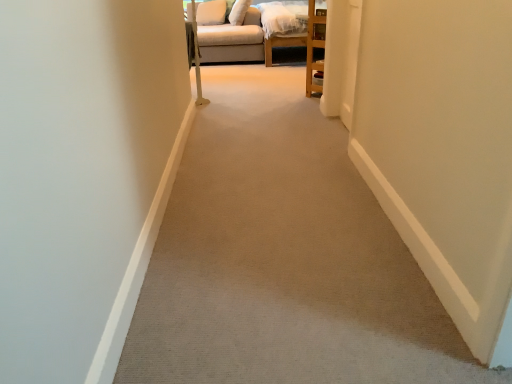
Question: Can you confirm if beige carpet at center is bigger than beige fabric pillow at upper center, which is the 1th pillow in right-to-left order?

Choices:
 (A) no
 (B) yes

Answer: (B)

Question: Is beige carpet at center positioned far away from beige fabric pillow at upper center, which is the 1th pillow in right-to-left order?

Choices:
 (A) yes
 (B) no

Answer: (A)

Question: From a real-world perspective, is beige carpet at center under beige fabric pillow at upper center, marked as the 2th pillow in a left-to-right arrangement?

Choices:
 (A) yes
 (B) no

Answer: (A)

Question: From a real-world perspective, is beige carpet at center on beige fabric pillow at upper center, marked as the 2th pillow in a left-to-right arrangement?

Choices:
 (A) no
 (B) yes

Answer: (A)

Question: Are beige carpet at center and beige fabric pillow at upper center, marked as the 2th pillow in a left-to-right arrangement, making contact?

Choices:
 (A) yes
 (B) no

Answer: (B)

Question: From the image's perspective, is white fabric pillow at upper center, the second pillow viewed from the right, located above or below beige carpet at center?

Choices:
 (A) below
 (B) above

Answer: (B)

Question: In the image, is white fabric pillow at upper center, marked as the 1th pillow in a left-to-right arrangement, on the left side or the right side of beige carpet at center?

Choices:
 (A) left
 (B) right

Answer: (A)

Question: From a real-world perspective, is white fabric pillow at upper center, marked as the 1th pillow in a left-to-right arrangement, above or below beige carpet at center?

Choices:
 (A) above
 (B) below

Answer: (A)

Question: Considering the positions of white fabric pillow at upper center, the second pillow viewed from the right, and beige carpet at center in the image, is white fabric pillow at upper center, the second pillow viewed from the right, bigger or smaller than beige carpet at center?

Choices:
 (A) big
 (B) small

Answer: (B)

Question: Which is correct: beige fabric pillow at upper center, marked as the 2th pillow in a left-to-right arrangement, is inside beige fabric couch at upper center, or outside of it?

Choices:
 (A) outside
 (B) inside

Answer: (B)

Question: In terms of width, does beige fabric pillow at upper center, marked as the 2th pillow in a left-to-right arrangement, look wider or thinner when compared to beige fabric couch at upper center?

Choices:
 (A) wide
 (B) thin

Answer: (B)

Question: Considering the positions of point (240, 21) and point (208, 31), is point (240, 21) closer or farther from the camera than point (208, 31)?

Choices:
 (A) closer
 (B) farther

Answer: (B)

Question: From the image's perspective, is beige fabric pillow at upper center, marked as the 2th pillow in a left-to-right arrangement, located above or below beige fabric couch at upper center?

Choices:
 (A) above
 (B) below

Answer: (A)

Question: From a real-world perspective, is beige fabric couch at upper center positioned above or below beige carpet at center?

Choices:
 (A) above
 (B) below

Answer: (A)

Question: Considering the positions of beige fabric couch at upper center and beige carpet at center in the image, is beige fabric couch at upper center taller or shorter than beige carpet at center?

Choices:
 (A) short
 (B) tall

Answer: (B)